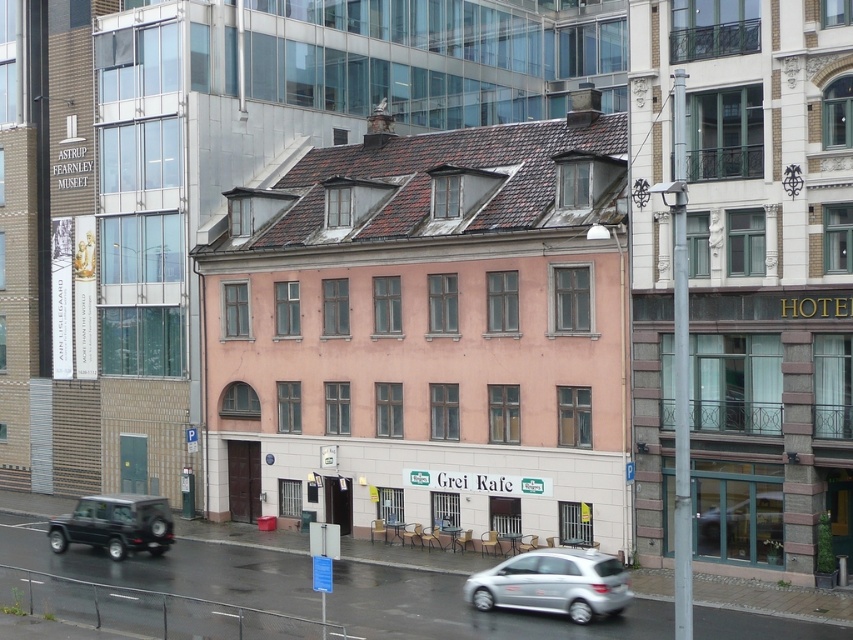
Question: Is the position of silver metallic hatchback at lower center less distant than that of matte black suv at lower left?

Choices:
 (A) no
 (B) yes

Answer: (B)

Question: Which point is farther to the camera?

Choices:
 (A) (119, 552)
 (B) (567, 550)

Answer: (A)

Question: Does silver metallic hatchback at lower center appear over matte black suv at lower left?

Choices:
 (A) yes
 (B) no

Answer: (A)

Question: Can you confirm if silver metallic hatchback at lower center is thinner than matte black suv at lower left?

Choices:
 (A) no
 (B) yes

Answer: (B)